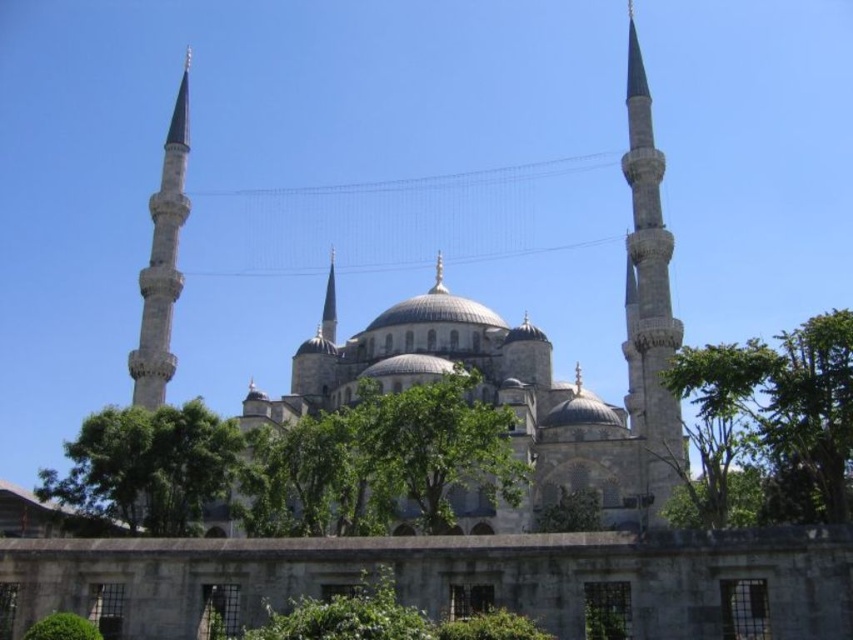
Can you confirm if green leafy tree at right is positioned to the right of smooth stone minaret at right?

Indeed, green leafy tree at right is positioned on the right side of smooth stone minaret at right.

Consider the image. How far apart are green leafy tree at right and smooth stone minaret at right?

A distance of 12.05 meters exists between green leafy tree at right and smooth stone minaret at right.

Does point (669, 515) come farther from viewer compared to point (665, 305)?

No.

Locate an element on the screen. This screenshot has height=640, width=853. green leafy tree at right is located at coordinates (769, 426).

Can you confirm if green leafy tree at right is thinner than green leafy tree at center?

In fact, green leafy tree at right might be wider than green leafy tree at center.

Is point (706, 374) behind point (473, 387)?

No, it is in front of (473, 387).

Find the location of a particular element. green leafy tree at right is located at coordinates (769, 426).

At what (x,y) coordinates should I click in order to perform the action: click on green leafy tree at right. Please return your answer as a coordinate pair (x, y). Looking at the image, I should click on click(769, 426).

Between green leafy tree at lower left and green leafy tree at lower center, which one is positioned higher?

green leafy tree at lower left is higher up.

Is green leafy tree at lower left closer to camera compared to green leafy tree at lower center?

Yes, it is in front of green leafy tree at lower center.

Is point (155, 417) positioned in front of point (548, 515)?

Yes, point (155, 417) is in front of point (548, 515).

This screenshot has height=640, width=853. Find the location of `green leafy tree at lower left`. green leafy tree at lower left is located at coordinates (148, 467).